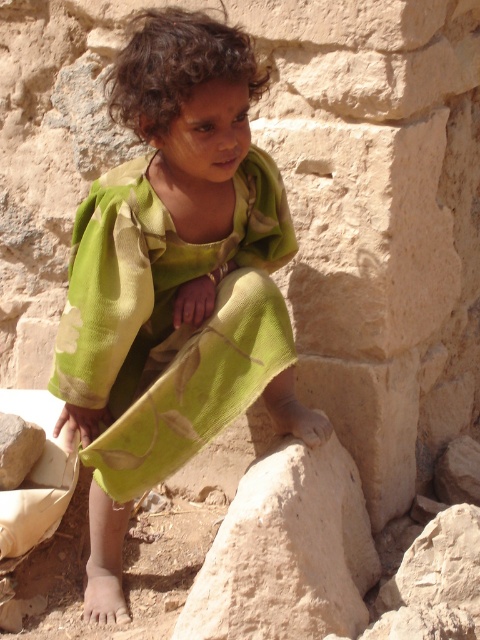
Question: Which point appears closest to the camera in this image?

Choices:
 (A) (240, 586)
 (B) (83, 444)

Answer: (A)

Question: Which point is farther to the camera?

Choices:
 (A) (262, 493)
 (B) (224, 246)

Answer: (B)

Question: Considering the relative positions of green fabric at center and smooth beige rock at lower center in the image provided, where is green fabric at center located with respect to smooth beige rock at lower center?

Choices:
 (A) left
 (B) right

Answer: (A)

Question: Does green fabric at center appear under smooth beige rock at lower center?

Choices:
 (A) yes
 (B) no

Answer: (B)

Question: Which object appears closest to the camera in this image?

Choices:
 (A) smooth beige rock at lower center
 (B) green fabric at center

Answer: (A)

Question: Does green fabric at center appear on the right side of smooth beige rock at lower center?

Choices:
 (A) yes
 (B) no

Answer: (B)